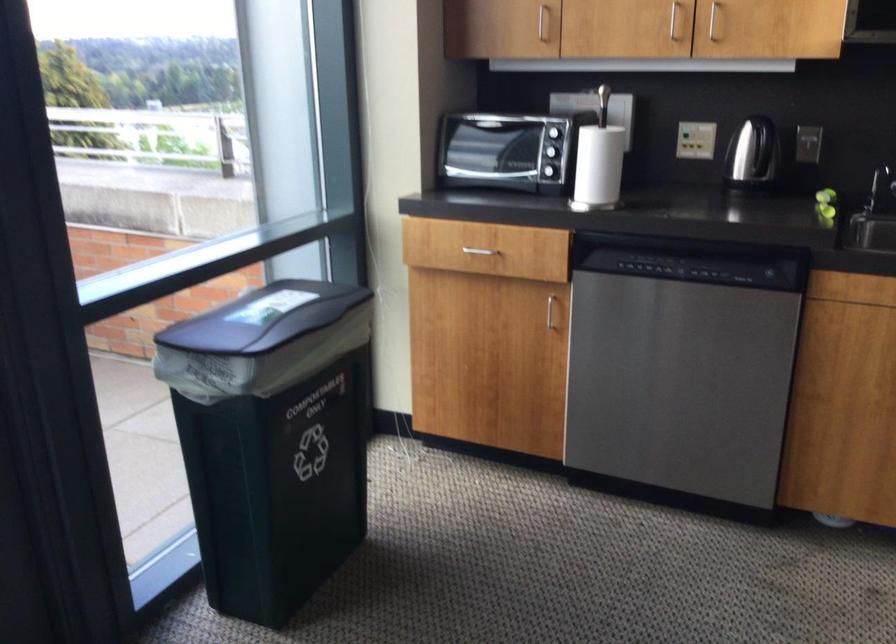
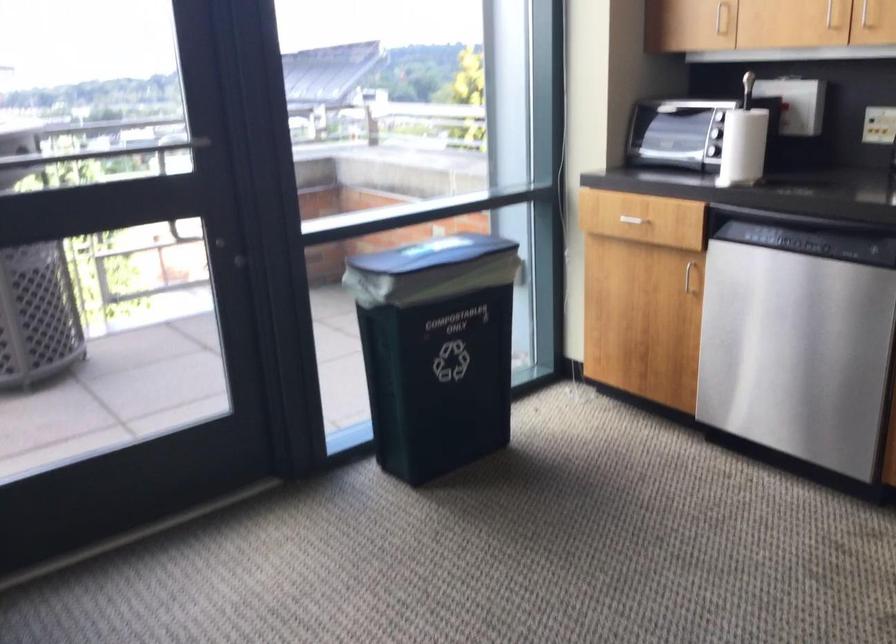
In a continuous first-person perspective shot, in which direction is the camera moving?

The cameraman walked toward right, backward.